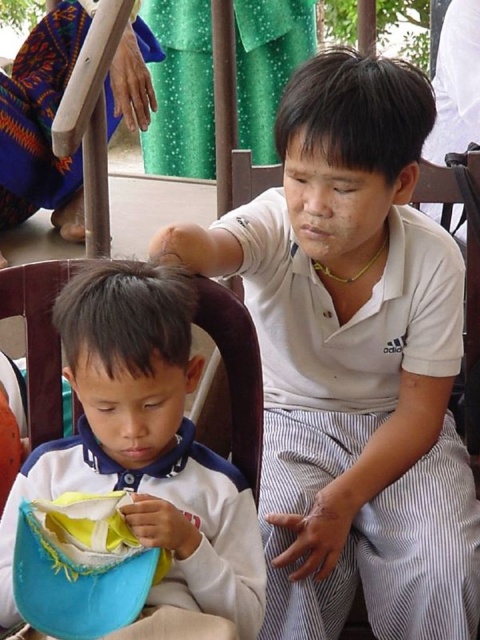
You are organizing a clothing display and need to arrange the white matte shirt at upper center and the soft yellow fabric at lower left on a shelf. The shelf has a height limit of 1 meter. Can both items be placed on the shelf without exceeding the height limit?

The white matte shirt at upper center is taller than the soft yellow fabric at lower left, but since the height limit is 1 meter, both items can be placed on the shelf as long as their combined height does not exceed the limit. However, the exact heights are not provided, so it depends on their individual measurements.

You are a photographer taking a picture of the scene. You want to ensure that both the white matte shirt at upper center and the white soft fabric at center are clearly visible in the frame. Which object should you adjust your focus to first to ensure proper exposure, considering their positions?

The white soft fabric at center should be focused on first because the white matte shirt at upper center is positioned on the right side of it, meaning the fabric is closer to the center of the frame and might require more attention for exposure balance.

You are standing in the image and want to place a small sticker exactly at the center of the white soft fabric at center. What coordinates should you use?

The coordinates for the center of the white soft fabric at center are at point (145,444).